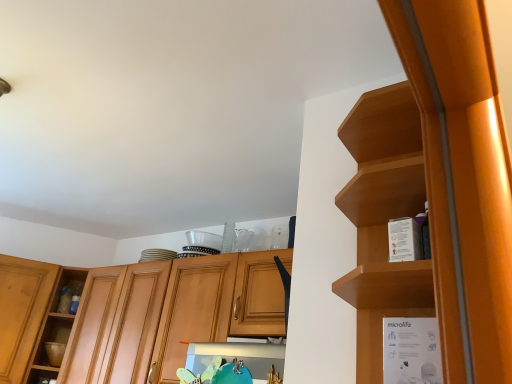
Question: Does white cardboard box at right have a greater width compared to wooden cabinet at center, which is the first cabinetry from back to front?

Choices:
 (A) yes
 (B) no

Answer: (B)

Question: Considering the relative sizes of white cardboard box at right and wooden cabinet at center, which is the second cabinetry in front-to-back order, in the image provided, is white cardboard box at right shorter than wooden cabinet at center, which is the second cabinetry in front-to-back order,?

Choices:
 (A) no
 (B) yes

Answer: (B)

Question: From a real-world perspective, is white cardboard box at right located beneath wooden cabinet at center, acting as the 2th cabinetry starting from the right?

Choices:
 (A) yes
 (B) no

Answer: (A)

Question: Is white cardboard box at right facing towards wooden cabinet at center, which is the first cabinetry from back to front?

Choices:
 (A) no
 (B) yes

Answer: (A)

Question: Is white cardboard box at right positioned beyond the bounds of wooden cabinet at center, arranged as the first cabinetry when viewed from the left?

Choices:
 (A) yes
 (B) no

Answer: (A)

Question: Relative to wooden cabinet at center, acting as the 2th cabinetry starting from the right, is white cardboard box at right in front or behind?

Choices:
 (A) behind
 (B) front

Answer: (B)

Question: From the image's perspective, is white cardboard box at right positioned above or below wooden cabinet at center, arranged as the first cabinetry when viewed from the left?

Choices:
 (A) above
 (B) below

Answer: (A)

Question: From a real-world perspective, is white cardboard box at right above or below wooden cabinet at center, which is the second cabinetry in front-to-back order?

Choices:
 (A) below
 (B) above

Answer: (A)

Question: Is white cardboard box at right taller or shorter than wooden cabinet at center, which is the second cabinetry in front-to-back order?

Choices:
 (A) tall
 (B) short

Answer: (B)

Question: Which is correct: wooden cabinet at center, arranged as the first cabinetry when viewed from the left, is inside wooden shelf at upper right, marked as the first cabinetry in a front-to-back arrangement, or outside of it?

Choices:
 (A) inside
 (B) outside

Answer: (B)

Question: From their relative heights in the image, would you say wooden cabinet at center, arranged as the first cabinetry when viewed from the left, is taller or shorter than wooden shelf at upper right, which is the first cabinetry in right-to-left order?

Choices:
 (A) tall
 (B) short

Answer: (A)

Question: Visually, is wooden cabinet at center, acting as the 2th cabinetry starting from the right, positioned to the left or to the right of wooden shelf at upper right, which is the first cabinetry in right-to-left order?

Choices:
 (A) left
 (B) right

Answer: (A)

Question: Looking at the image, does wooden cabinet at center, which is the first cabinetry from back to front, seem bigger or smaller compared to wooden shelf at upper right, which is the first cabinetry in right-to-left order?

Choices:
 (A) small
 (B) big

Answer: (B)

Question: From the image's perspective, relative to wooden cabinet at center, which is the first cabinetry from back to front, is wooden shelf at upper right, marked as the first cabinetry in a front-to-back arrangement, above or below?

Choices:
 (A) above
 (B) below

Answer: (A)

Question: In terms of size, does wooden shelf at upper right, marked as the first cabinetry in a front-to-back arrangement, appear bigger or smaller than wooden cabinet at center, which is the first cabinetry from back to front?

Choices:
 (A) small
 (B) big

Answer: (A)